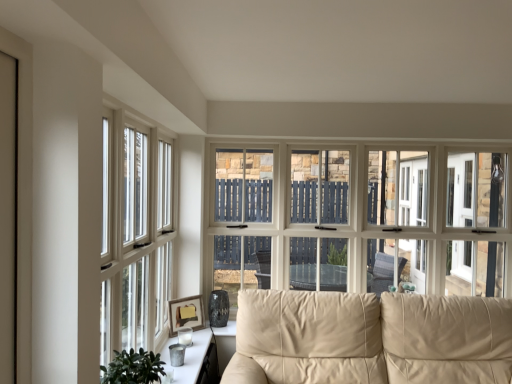
Question: Is green leafy plant at lower left placed right next to white wood window at left, which appears as the first window when viewed from the front?

Choices:
 (A) no
 (B) yes

Answer: (A)

Question: Is the position of green leafy plant at lower left less distant than that of white wood window at left, which is counted as the first window, starting from the left?

Choices:
 (A) yes
 (B) no

Answer: (A)

Question: From the image's perspective, is green leafy plant at lower left on top of white wood window at left, acting as the second window starting from the right?

Choices:
 (A) no
 (B) yes

Answer: (A)

Question: From a real-world perspective, is green leafy plant at lower left on top of white wood window at left, which is counted as the first window, starting from the left?

Choices:
 (A) no
 (B) yes

Answer: (A)

Question: Considering the relative positions of green leafy plant at lower left and white wood window at left, placed as the 2th window when sorted from back to front, in the image provided, is green leafy plant at lower left to the left of white wood window at left, placed as the 2th window when sorted from back to front, from the viewer's perspective?

Choices:
 (A) no
 (B) yes

Answer: (A)

Question: Is green leafy plant at lower left taller than white wood window at left, which appears as the first window when viewed from the front?

Choices:
 (A) no
 (B) yes

Answer: (A)

Question: Can you confirm if matte wooden picture frame at lower left is smaller than green leafy plant at lower left?

Choices:
 (A) no
 (B) yes

Answer: (B)

Question: Can you confirm if matte wooden picture frame at lower left is positioned to the left of green leafy plant at lower left?

Choices:
 (A) yes
 (B) no

Answer: (A)

Question: From the image's perspective, is matte wooden picture frame at lower left below green leafy plant at lower left?

Choices:
 (A) no
 (B) yes

Answer: (B)

Question: Are matte wooden picture frame at lower left and green leafy plant at lower left beside each other?

Choices:
 (A) yes
 (B) no

Answer: (B)

Question: Is matte wooden picture frame at lower left at the right side of green leafy plant at lower left?

Choices:
 (A) no
 (B) yes

Answer: (A)

Question: Is matte wooden picture frame at lower left closer to camera compared to green leafy plant at lower left?

Choices:
 (A) yes
 (B) no

Answer: (B)

Question: Is beige leather couch at center far away from white wood window at left, acting as the second window starting from the right?

Choices:
 (A) no
 (B) yes

Answer: (B)